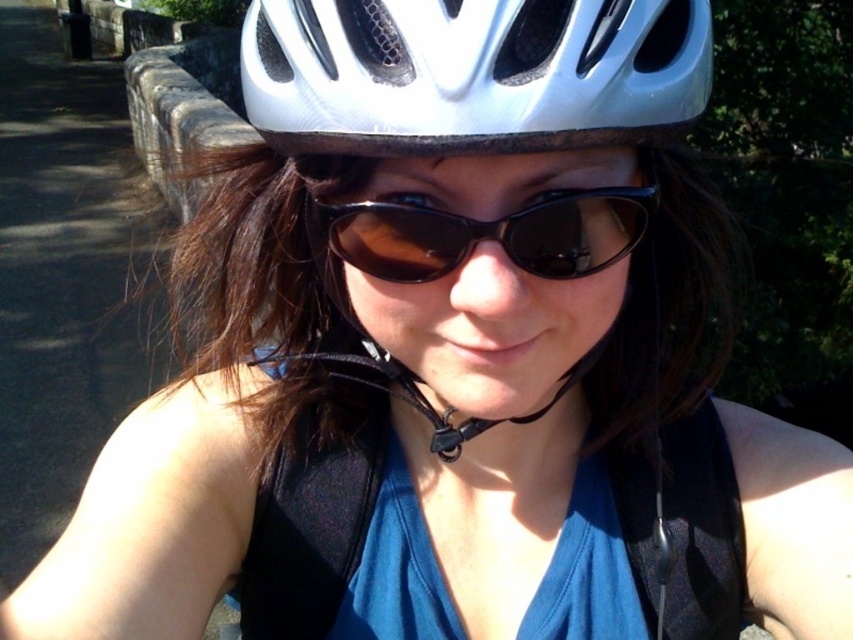
Between white matte bicycle helmet at center and white matte helmet at center, which one has less height?

white matte bicycle helmet at center

Is white matte bicycle helmet at center smaller than white matte helmet at center?

Yes, white matte bicycle helmet at center is smaller than white matte helmet at center.

Is point (694, 106) positioned in front of point (462, 3)?

That is False.

This screenshot has height=640, width=853. I want to click on white matte bicycle helmet at center, so click(x=473, y=74).

Where is `white matte bicycle helmet at center`? This screenshot has width=853, height=640. white matte bicycle helmet at center is located at coordinates (473, 74).

Is point (601, 84) positioned before point (368, 260)?

That is True.

Who is more distant from viewer, (323,104) or (425,220)?

Point (425,220)

At what (x,y) coordinates should I click in order to perform the action: click on white matte bicycle helmet at center. Please return your answer as a coordinate pair (x, y). Looking at the image, I should click on (473, 74).

Is black fabric vest at center above brown matte sunglasses at center?

No.

Between black fabric vest at center and brown matte sunglasses at center, which one appears on the right side from the viewer's perspective?

From the viewer's perspective, black fabric vest at center appears more on the right side.

Is point (302, 448) positioned after point (508, 225)?

Yes, it is behind point (508, 225).

Find the location of a particular element. The image size is (853, 640). black fabric vest at center is located at coordinates (315, 529).